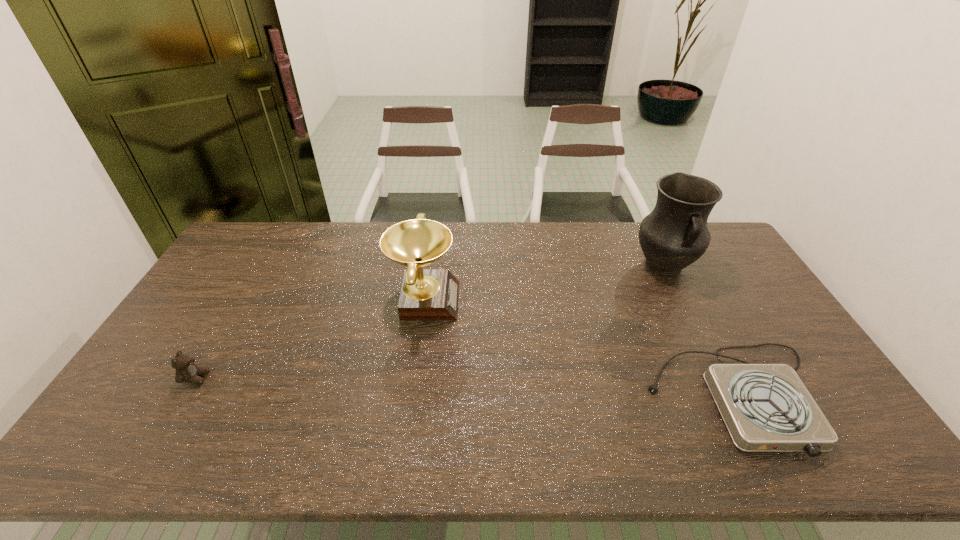
I want to click on vacant space at the far left corner, so click(x=277, y=231).

Locate an element on the screen. vacant point located between the leftmost object and the tallest object is located at coordinates (430, 322).

Find the location of a particular element. The image size is (960, 540). free space between the second tallest object and the third tallest object is located at coordinates (310, 339).

At what (x,y) coordinates should I click in order to perform the action: click on vacant area that lies between the teddy bear and the pitcher. Please return your answer as a coordinate pair (x, y). Looking at the image, I should click on (430, 322).

Where is `free area in between the award and the leftmost object`? free area in between the award and the leftmost object is located at coordinates (310, 339).

The image size is (960, 540). In order to click on unoccupied position between the leftmost object and the third object from right to left in this screenshot , I will do `click(310, 339)`.

Locate an element on the screen. The height and width of the screenshot is (540, 960). unoccupied area between the tallest object and the third shortest object is located at coordinates (544, 283).

I want to click on vacant point located between the shortest object and the leftmost object, so click(467, 388).

The image size is (960, 540). I want to click on vacant point located between the tallest object and the hotplate, so click(x=701, y=332).

This screenshot has height=540, width=960. Find the location of `vacant area that lies between the pitcher and the leftmost object`. vacant area that lies between the pitcher and the leftmost object is located at coordinates (430, 322).